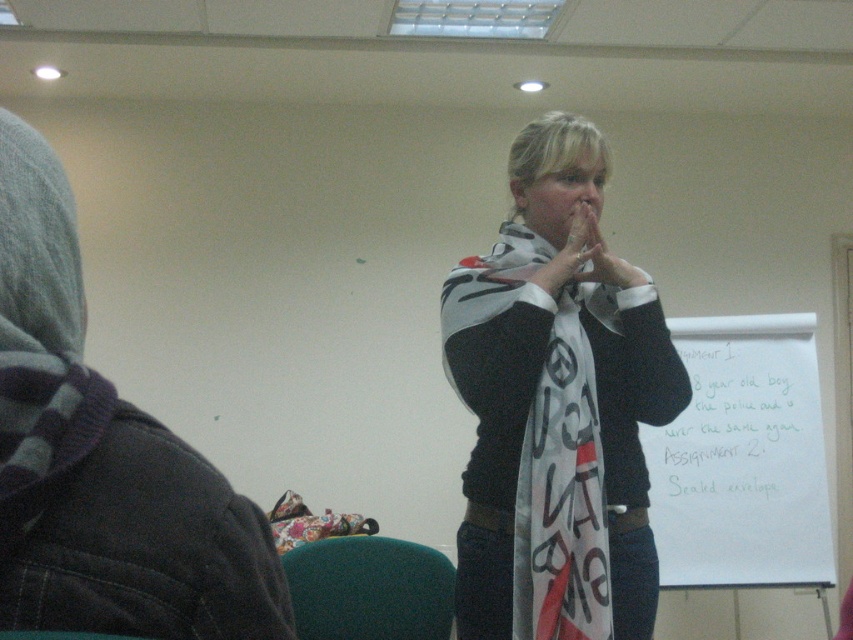
The width and height of the screenshot is (853, 640). What do you see at coordinates (102, 460) in the screenshot? I see `gray fleece hoodie at left` at bounding box center [102, 460].

What do you see at coordinates (102, 460) in the screenshot? I see `gray fleece hoodie at left` at bounding box center [102, 460].

Locate an element on the screen. This screenshot has height=640, width=853. gray fleece hoodie at left is located at coordinates [x=102, y=460].

Does gray fleece hoodie at left have a smaller size compared to matte black nose at center?

No, gray fleece hoodie at left is not smaller than matte black nose at center.

Can you confirm if gray fleece hoodie at left is shorter than matte black nose at center?

In fact, gray fleece hoodie at left may be taller than matte black nose at center.

Is point (80, 452) closer to viewer compared to point (585, 180)?

Yes, point (80, 452) is closer to viewer.

The image size is (853, 640). Identify the location of gray fleece hoodie at left. (102, 460).

Can you confirm if white fabric hand at center is positioned above matte black nose at center?

No.

At what (x,y) coordinates should I click in order to perform the action: click on white fabric hand at center. Please return your answer as a coordinate pair (x, y). This screenshot has height=640, width=853. Looking at the image, I should click on (573, 252).

Which is in front, point (576, 228) or point (590, 188)?

Point (576, 228) is more forward.

The width and height of the screenshot is (853, 640). Find the location of `white fabric hand at center`. white fabric hand at center is located at coordinates (573, 252).